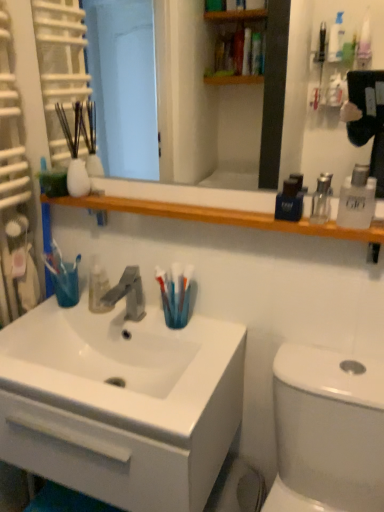
Find the location of a particular element. satin nickel faucet at center is located at coordinates (123, 295).

What is the approximate height of white glossy cabinet at lower left?

white glossy cabinet at lower left is 13.30 inches tall.

What is the approximate width of white glossy cabinet at lower left?

white glossy cabinet at lower left is 16.33 inches in width.

Locate an element on the screen. This screenshot has width=384, height=512. wooden shelf at upper center is located at coordinates (218, 216).

This screenshot has width=384, height=512. Find the location of `white glossy toilet at lower right`. white glossy toilet at lower right is located at coordinates (327, 432).

What do you see at coordinates (357, 199) in the screenshot? The height and width of the screenshot is (512, 384). I see `clear plastic bottle at right, marked as the third mouthwash in a left-to-right arrangement` at bounding box center [357, 199].

Measure the distance between point (361, 219) and camera.

A distance of 36.85 inches exists between point (361, 219) and camera.

This screenshot has width=384, height=512. I want to click on clear glass mouthwash at upper right, placed as the 2th mouthwash when sorted from left to right, so (321, 199).

From the picture: Which of these two, clear plastic bottle at right, marked as the first mouthwash in a right-to-left arrangement, or satin nickel faucet at center, is wider?

satin nickel faucet at center is wider.

Is clear plastic bottle at right, marked as the first mouthwash in a right-to-left arrangement, positioned with its back to satin nickel faucet at center?

No, satin nickel faucet at center is not at the back of clear plastic bottle at right, marked as the first mouthwash in a right-to-left arrangement.

Is clear plastic bottle at right, marked as the third mouthwash in a left-to-right arrangement, closer to camera compared to satin nickel faucet at center?

Yes, it is.

Who is taller, clear plastic bottle at right, marked as the first mouthwash in a right-to-left arrangement, or satin nickel faucet at center?

satin nickel faucet at center.

How far apart are blue glossy mouthwash at upper right, positioned as the third mouthwash in right-to-left order, and white glossy cabinet at lower left?

23.79 inches.

Is blue glossy mouthwash at upper right, positioned as the third mouthwash in right-to-left order, positioned far away from white glossy cabinet at lower left?

No, blue glossy mouthwash at upper right, positioned as the third mouthwash in right-to-left order, is in close proximity to white glossy cabinet at lower left.

Does point (298, 188) lie behind point (11, 448)?

No.

Which object is thinner, blue glossy mouthwash at upper right, positioned as the third mouthwash in right-to-left order, or white glossy cabinet at lower left?

Thinner between the two is blue glossy mouthwash at upper right, positioned as the third mouthwash in right-to-left order.

Which is in front, blue glossy mouthwash at upper right, positioned as the third mouthwash in right-to-left order, or clear plastic bottle at right, marked as the third mouthwash in a left-to-right arrangement?

clear plastic bottle at right, marked as the third mouthwash in a left-to-right arrangement.

Is blue glossy mouthwash at upper right, the 1th mouthwash positioned from the left, looking in the opposite direction of clear plastic bottle at right, marked as the first mouthwash in a right-to-left arrangement?

blue glossy mouthwash at upper right, the 1th mouthwash positioned from the left, is not turned away from clear plastic bottle at right, marked as the first mouthwash in a right-to-left arrangement.

Is blue glossy mouthwash at upper right, positioned as the third mouthwash in right-to-left order, shorter than clear plastic bottle at right, marked as the first mouthwash in a right-to-left arrangement?

Correct, blue glossy mouthwash at upper right, positioned as the third mouthwash in right-to-left order, is not as tall as clear plastic bottle at right, marked as the first mouthwash in a right-to-left arrangement.

From a real-world perspective, is blue glossy mouthwash at upper right, positioned as the third mouthwash in right-to-left order, positioned above or below clear plastic bottle at right, marked as the first mouthwash in a right-to-left arrangement?

Clearly, from a real-world perspective, blue glossy mouthwash at upper right, positioned as the third mouthwash in right-to-left order, is below clear plastic bottle at right, marked as the first mouthwash in a right-to-left arrangement.

Are blue plastic toothbrush at sink and clear plastic bottle at right, marked as the first mouthwash in a right-to-left arrangement, making contact?

No, blue plastic toothbrush at sink is not making contact with clear plastic bottle at right, marked as the first mouthwash in a right-to-left arrangement.

Who is shorter, blue plastic toothbrush at sink or clear plastic bottle at right, marked as the third mouthwash in a left-to-right arrangement?

Standing shorter between the two is clear plastic bottle at right, marked as the third mouthwash in a left-to-right arrangement.

Looking at this image, is blue plastic toothbrush at sink to the left or to the right of clear plastic bottle at right, marked as the first mouthwash in a right-to-left arrangement, in the image?

Based on their positions, blue plastic toothbrush at sink is located to the left of clear plastic bottle at right, marked as the first mouthwash in a right-to-left arrangement.

Is blue plastic toothbrush at sink outside of clear plastic bottle at right, marked as the first mouthwash in a right-to-left arrangement?

blue plastic toothbrush at sink lies outside clear plastic bottle at right, marked as the first mouthwash in a right-to-left arrangement,'s area.

Visually, is wooden shelf at upper center positioned to the left or to the right of wooden shelf at upper center?

Based on their positions, wooden shelf at upper center is located to the left of wooden shelf at upper center.

Can you confirm if wooden shelf at upper center is shorter than wooden shelf at upper center?

Incorrect, the height of wooden shelf at upper center does not fall short of that of wooden shelf at upper center.

From the image's perspective, who appears lower, wooden shelf at upper center or wooden shelf at upper center?

wooden shelf at upper center is shown below in the image.

Do you think white glossy cabinet at lower left is within clear glass mouthwash at upper right, the second mouthwash positioned from the right, or outside of it?

The correct answer is: outside.

Considering the sizes of white glossy cabinet at lower left and clear glass mouthwash at upper right, placed as the 2th mouthwash when sorted from left to right, in the image, is white glossy cabinet at lower left bigger or smaller than clear glass mouthwash at upper right, placed as the 2th mouthwash when sorted from left to right,?

In the image, white glossy cabinet at lower left appears to be larger than clear glass mouthwash at upper right, placed as the 2th mouthwash when sorted from left to right.

Could you tell me if white glossy cabinet at lower left is facing clear glass mouthwash at upper right, the second mouthwash positioned from the right?

No.

Between white glossy cabinet at lower left and clear glass mouthwash at upper right, placed as the 2th mouthwash when sorted from left to right, which one appears on the left side from the viewer's perspective?

Positioned to the left is white glossy cabinet at lower left.

Is clear glass mouthwash at upper right, the second mouthwash positioned from the right, positioned with its back to white glossy cabinet at lower left?

clear glass mouthwash at upper right, the second mouthwash positioned from the right, is not turned away from white glossy cabinet at lower left.

From a real-world perspective, is clear glass mouthwash at upper right, placed as the 2th mouthwash when sorted from left to right, positioned above or below white glossy cabinet at lower left?

Clearly, from a real-world perspective, clear glass mouthwash at upper right, placed as the 2th mouthwash when sorted from left to right, is above white glossy cabinet at lower left.

Who is bigger, clear glass mouthwash at upper right, placed as the 2th mouthwash when sorted from left to right, or white glossy cabinet at lower left?

white glossy cabinet at lower left.

Image resolution: width=384 pixels, height=512 pixels. I want to click on bathroom cabinet that is in front of the clear glass mouthwash at upper right, placed as the 2th mouthwash when sorted from left to right, so click(121, 403).

This screenshot has height=512, width=384. Find the location of `mouthwash that is the 3rd object located in front of the satin nickel faucet at center`. mouthwash that is the 3rd object located in front of the satin nickel faucet at center is located at coordinates (357, 199).

Find the location of `the 3rd mouthwash behind the white glossy cabinet at lower left`. the 3rd mouthwash behind the white glossy cabinet at lower left is located at coordinates (290, 199).

From the image, which object appears to be nearer to white glossy cabinet at lower left, blue plastic toothbrush at sink or wooden shelf at upper center?

blue plastic toothbrush at sink is closer to white glossy cabinet at lower left.

Which object lies nearer to the anchor point clear glass mouthwash at upper right, the second mouthwash positioned from the right, blue glossy mouthwash at upper right, the 1th mouthwash positioned from the left, or wooden shelf at upper center?

blue glossy mouthwash at upper right, the 1th mouthwash positioned from the left, lies closer to clear glass mouthwash at upper right, the second mouthwash positioned from the right, than the other object.

Looking at this image, when comparing their distances from clear plastic bottle at right, marked as the first mouthwash in a right-to-left arrangement, does clear glass mouthwash at upper right, placed as the 2th mouthwash when sorted from left to right, or wooden shelf at upper center seem further?

Based on the image, wooden shelf at upper center appears to be further to clear plastic bottle at right, marked as the first mouthwash in a right-to-left arrangement.

When comparing their distances from clear plastic bottle at right, marked as the third mouthwash in a left-to-right arrangement, does blue plastic toothbrush at sink or wooden shelf at upper center seem closer?

blue plastic toothbrush at sink is positioned closer to the anchor clear plastic bottle at right, marked as the third mouthwash in a left-to-right arrangement.

When comparing their distances from white glossy toilet at lower right, does white glossy cabinet at lower left or satin nickel faucet at center seem further?

The object further to white glossy toilet at lower right is satin nickel faucet at center.

Considering their positions, is wooden shelf at upper center positioned further to blue plastic toothbrush at sink than white glossy toilet at lower right?

wooden shelf at upper center lies further to blue plastic toothbrush at sink than the other object.

Which object lies nearer to the anchor point wooden shelf at upper center, white glossy cabinet at lower left or satin nickel faucet at center?

satin nickel faucet at center.

Looking at the image, which one is located closer to clear glass mouthwash at upper right, the second mouthwash positioned from the right, blue glossy mouthwash at upper right, positioned as the third mouthwash in right-to-left order, or clear plastic bottle at right, marked as the third mouthwash in a left-to-right arrangement?

clear plastic bottle at right, marked as the third mouthwash in a left-to-right arrangement, is closer to clear glass mouthwash at upper right, the second mouthwash positioned from the right.

At what (x,y) coordinates should I click in order to perform the action: click on balustrade between satin nickel faucet at center and clear plastic bottle at right, marked as the third mouthwash in a left-to-right arrangement, in the horizontal direction. Please return your answer as a coordinate pair (x, y). Looking at the image, I should click on (218, 216).

Locate an element on the screen. mouthwash located between wooden shelf at upper center and clear glass mouthwash at upper right, placed as the 2th mouthwash when sorted from left to right, in the left-right direction is located at coordinates (290, 199).

In order to click on toothbrush between blue glossy mouthwash at upper right, the 1th mouthwash positioned from the left, and white glossy cabinet at lower left, in the vertical direction in this screenshot , I will do `click(175, 293)`.

Locate an element on the screen. plumbing fixture between white glossy cabinet at lower left and clear glass mouthwash at upper right, placed as the 2th mouthwash when sorted from left to right, from left to right is located at coordinates (123, 295).